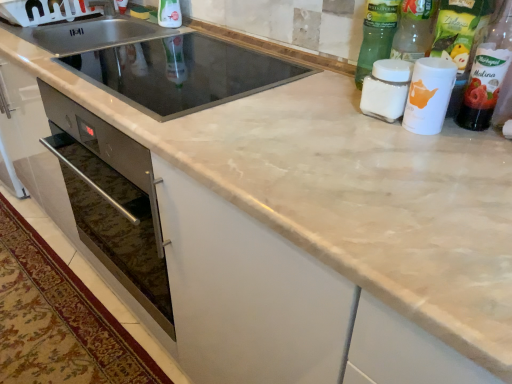
At what (x,y) coordinates should I click in order to perform the action: click on free space that is to the left of translucent plastic bottle at upper right, placed as the sixth bottle when sorted from left to right. Please return your answer as a coordinate pair (x, y). The height and width of the screenshot is (384, 512). Looking at the image, I should click on (386, 128).